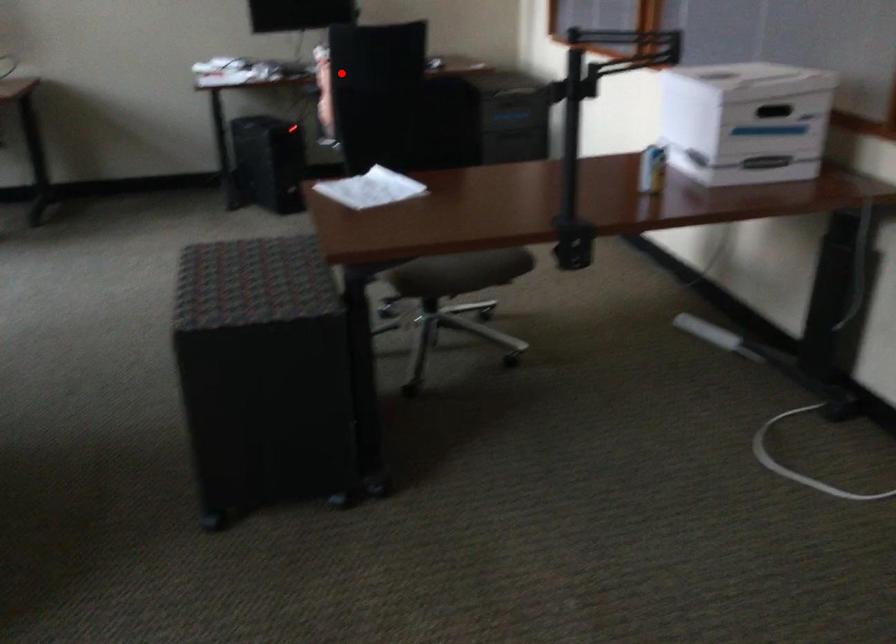
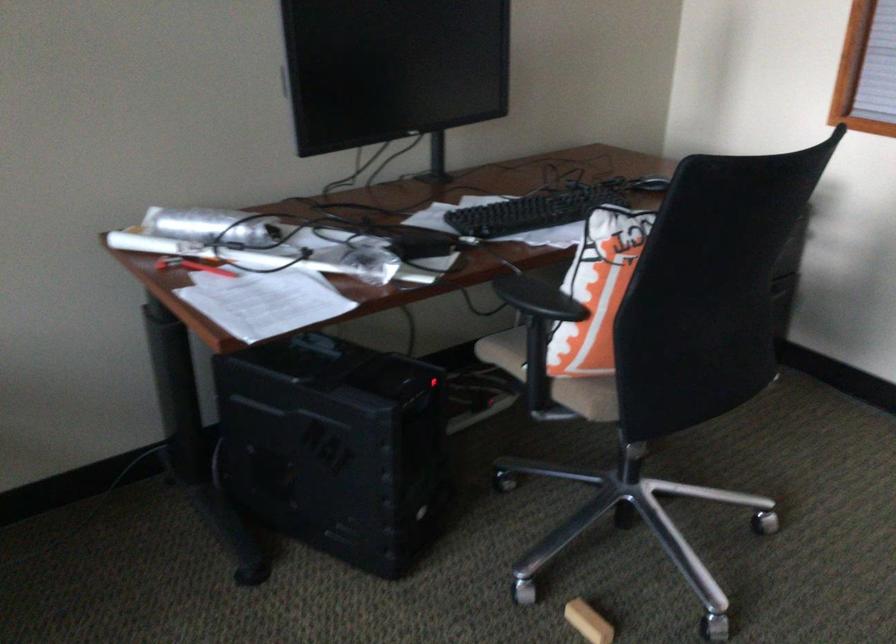
In the second image, find the point that corresponds to the highlighted location in the first image.

(597, 290)